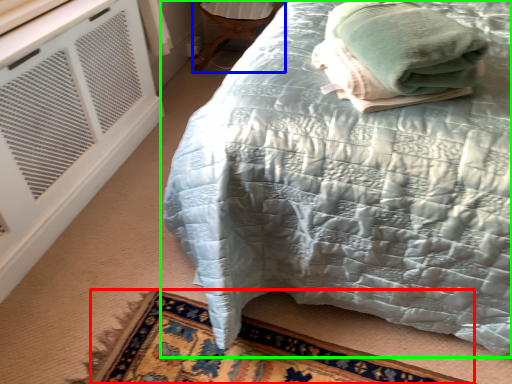
Question: Considering the real-world distances, which object is farthest from mat (highlighted by a red box)? furniture (highlighted by a blue box) or bed (highlighted by a green box)?

Choices:
 (A) furniture
 (B) bed

Answer: (A)